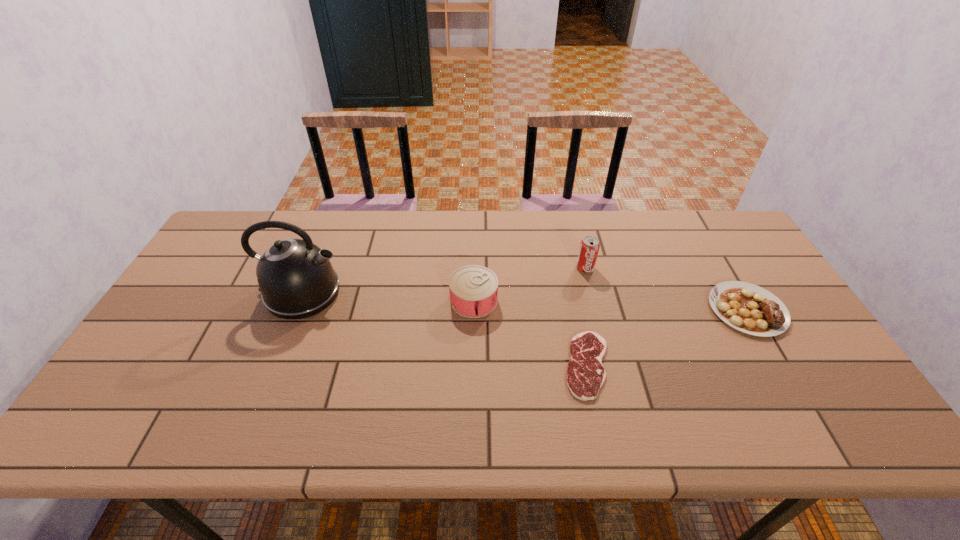
You are a GUI agent. You are given a task and a screenshot of the screen. Output one action in this format:
    pyautogui.click(x=<x>, y=<y>)
    Task: Click on the vacant space at the far right corner of the desktop
    The width and height of the screenshot is (960, 540).
    Given the screenshot: What is the action you would take?
    pyautogui.click(x=735, y=238)

What are the coordinates of `free spot between the tallest object and the second object from left to right` in the screenshot? It's located at (388, 296).

Find the location of `vacant point located between the left steak and the soda can`. vacant point located between the left steak and the soda can is located at coordinates (587, 316).

Identify the location of free space between the tallest object and the third tallest object. (388, 296).

Where is `vacant region between the kettle and the rightmost object`? The width and height of the screenshot is (960, 540). vacant region between the kettle and the rightmost object is located at coordinates (525, 301).

I want to click on free space between the fourth shortest object and the leftmost object, so click(444, 280).

Where is `free space between the second shortest object and the soda can`? Image resolution: width=960 pixels, height=540 pixels. free space between the second shortest object and the soda can is located at coordinates (666, 289).

You are a GUI agent. You are given a task and a screenshot of the screen. Output one action in this format:
    pyautogui.click(x=<x>, y=<y>)
    Task: Click on the free space that is in between the soda can and the taller steak
    The width and height of the screenshot is (960, 540).
    Given the screenshot: What is the action you would take?
    pyautogui.click(x=666, y=289)

In order to click on free spot between the fourth tallest object and the shorter steak in this screenshot , I will do `click(667, 338)`.

Where is `empty location between the shortest object and the fourth shortest object`? The height and width of the screenshot is (540, 960). empty location between the shortest object and the fourth shortest object is located at coordinates (587, 316).